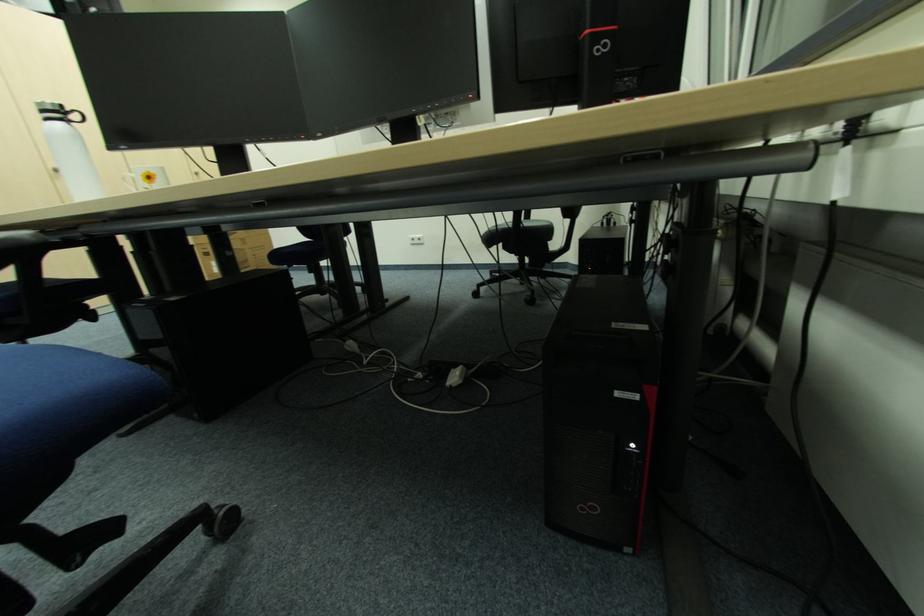
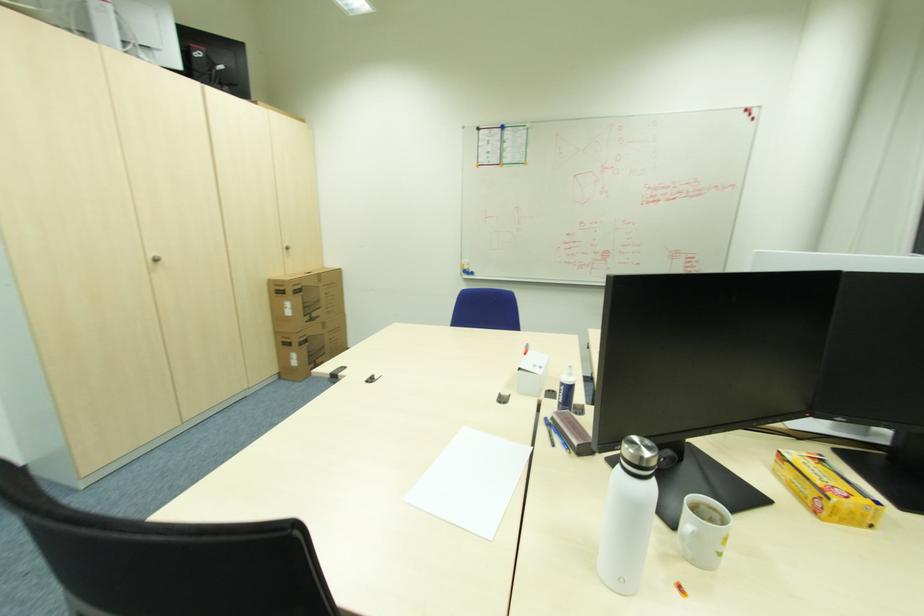
Question: Which direction would the cameraman need to move to produce the second image? Reply with the corresponding letter.

Choices:
 (A) Left
 (B) Right
 (C) Forward
 (D) Backward

Answer: (A)